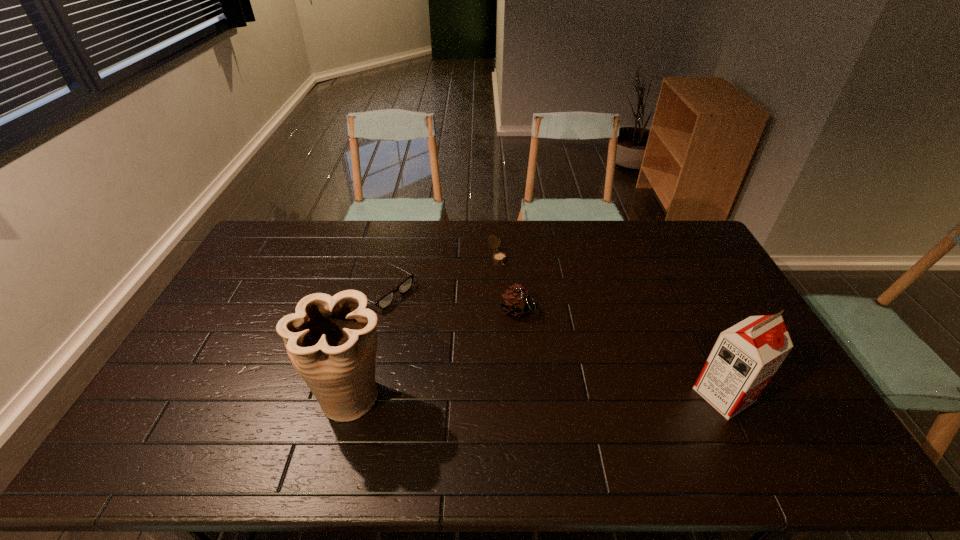
Image resolution: width=960 pixels, height=540 pixels. I want to click on vacant space that satisfies the following two spatial constraints: 1. on the back side of the urn; 2. on the left side of the soya milk, so click(x=352, y=395).

Where is `free location that satisfies the following two spatial constraints: 1. on the front side of the rightmost object; 2. on the right side of the shortest object`? free location that satisfies the following two spatial constraints: 1. on the front side of the rightmost object; 2. on the right side of the shortest object is located at coordinates (357, 395).

Locate an element on the screen. This screenshot has width=960, height=540. free location that satisfies the following two spatial constraints: 1. on the front side of the spectacles; 2. on the right side of the rightmost object is located at coordinates (357, 395).